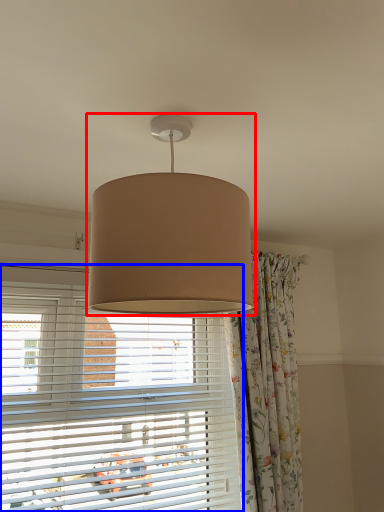
Question: Which object appears farthest to the camera in this image, lamp (highlighted by a red box) or window blind (highlighted by a blue box)?

Choices:
 (A) lamp
 (B) window blind

Answer: (B)